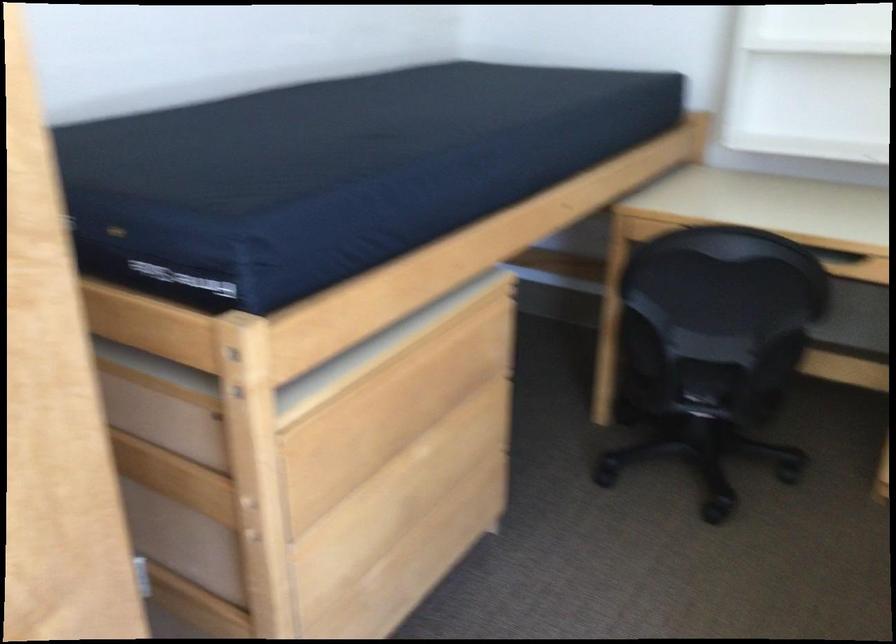
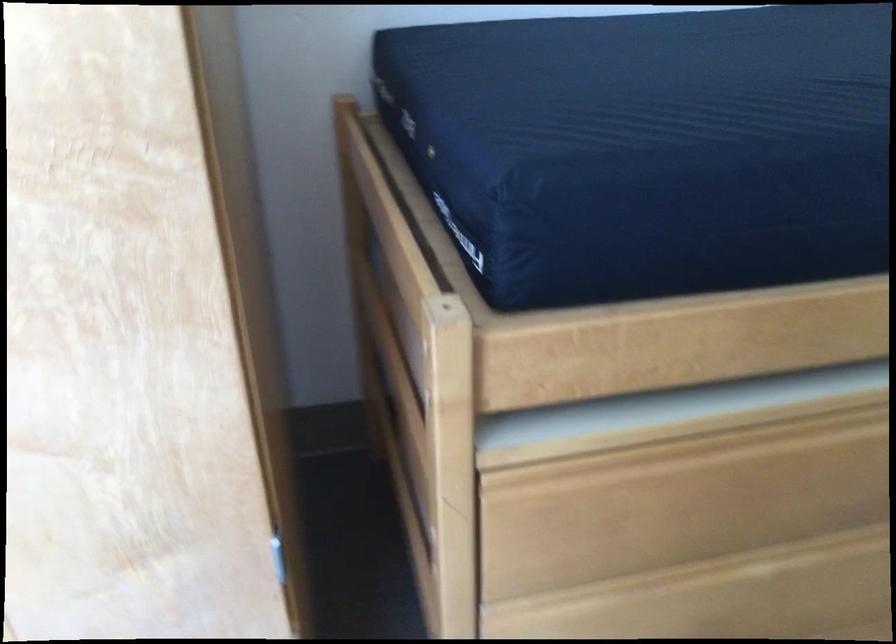
Question: Based on the continuous images, in which direction is the camera rotating? Reply with the corresponding letter.

Choices:
 (A) Left
 (B) Right
 (C) Up
 (D) Down

Answer: (A)